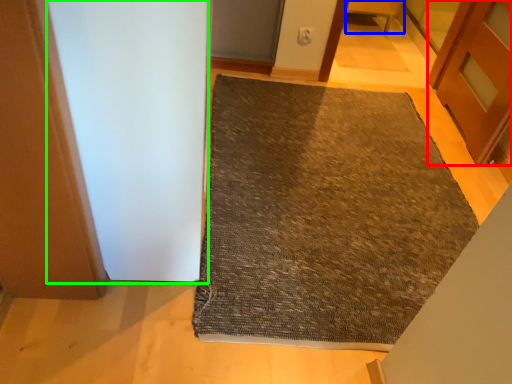
Question: Which is nearer to the door (highlighted by a red box)? furniture (highlighted by a blue box) or screen door (highlighted by a green box).

Choices:
 (A) furniture
 (B) screen door

Answer: (A)